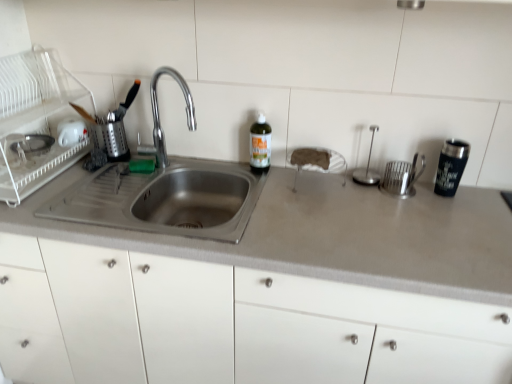
At what (x,y) coordinates should I click in order to perform the action: click on free point above gray matte countertop at center (from a real-world perspective). Please return your answer as a coordinate pair (x, y). This screenshot has height=384, width=512. Looking at the image, I should click on (273, 205).